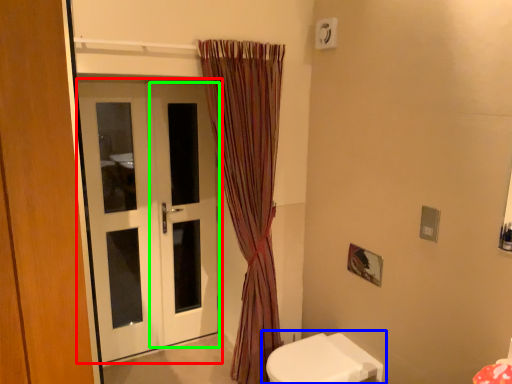
Question: Which object is the farthest from door (highlighted by a red box)? Choose among these: toilet (highlighted by a blue box) or screen door (highlighted by a green box).

Choices:
 (A) toilet
 (B) screen door

Answer: (A)